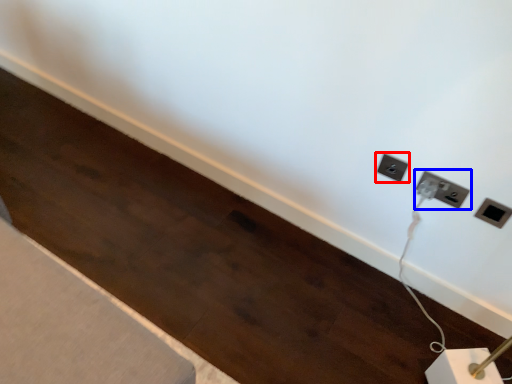
Question: Which object appears farthest to the camera in this image, power plugs and sockets (highlighted by a red box) or power plugs and sockets (highlighted by a blue box)?

Choices:
 (A) power plugs and sockets
 (B) power plugs and sockets

Answer: (A)